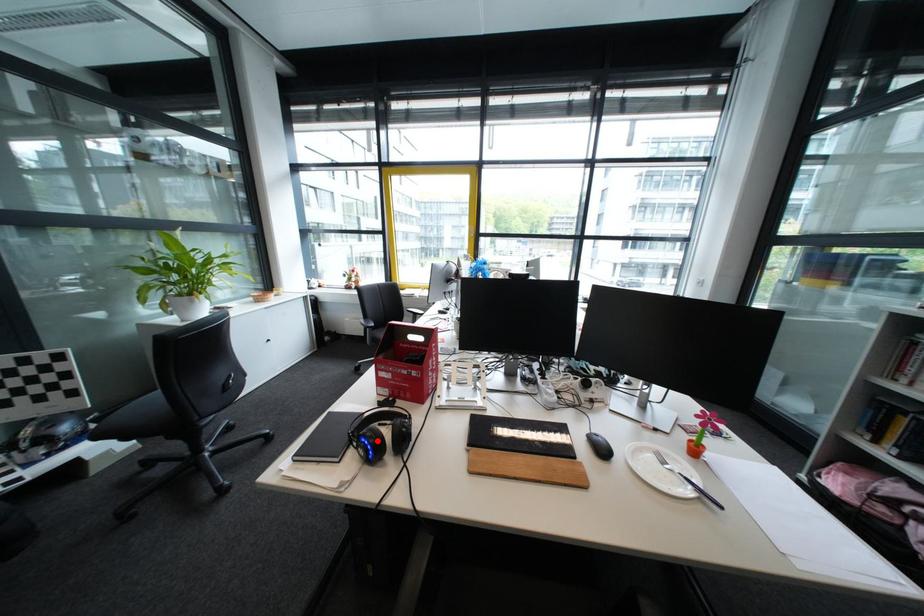
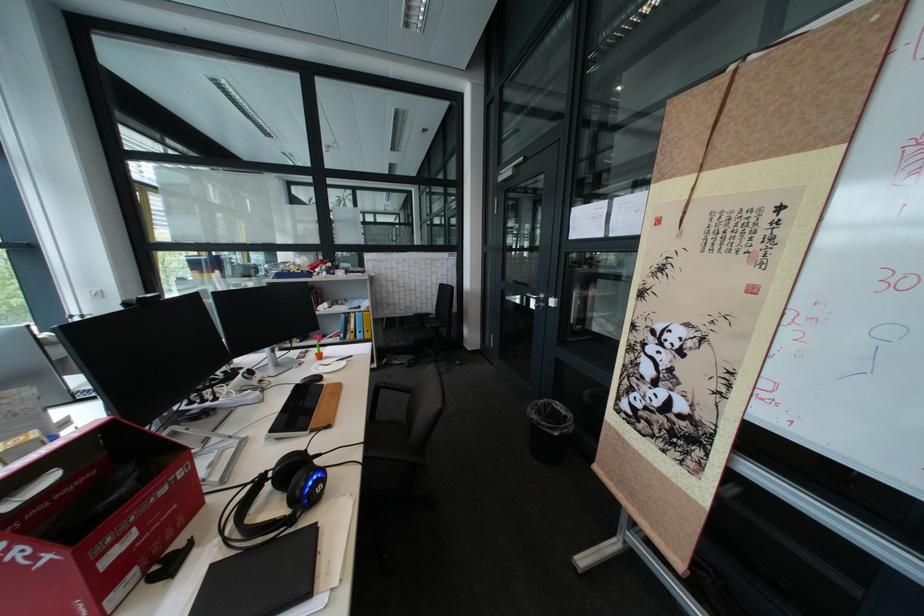
Question: I am providing you with two images of the same scene from different viewpoints. Image1 has a red point marked. In image2, the corresponding 3D location appears at what relative position? Reply with the corresponding letter.

Choices:
 (A) Closer
 (B) Farther

Answer: (A)